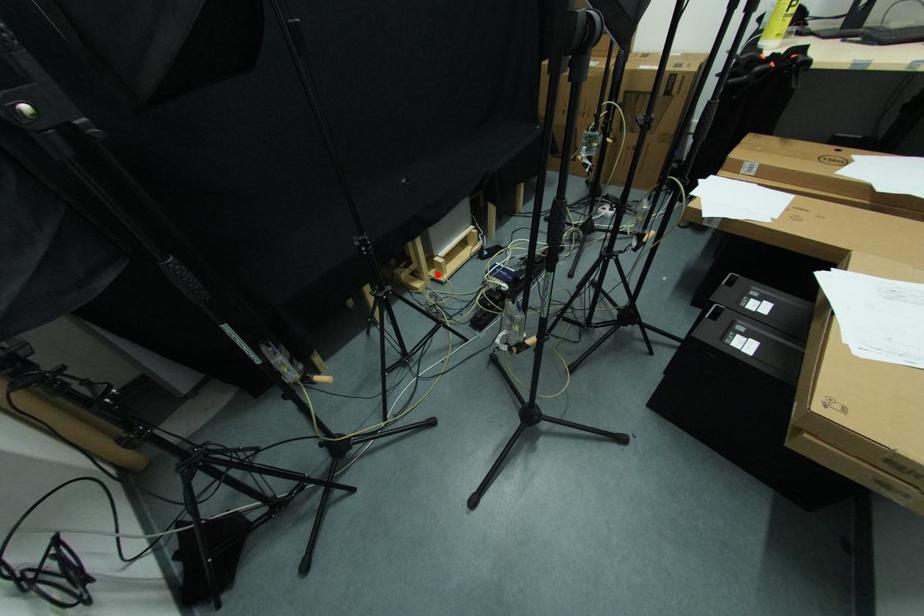
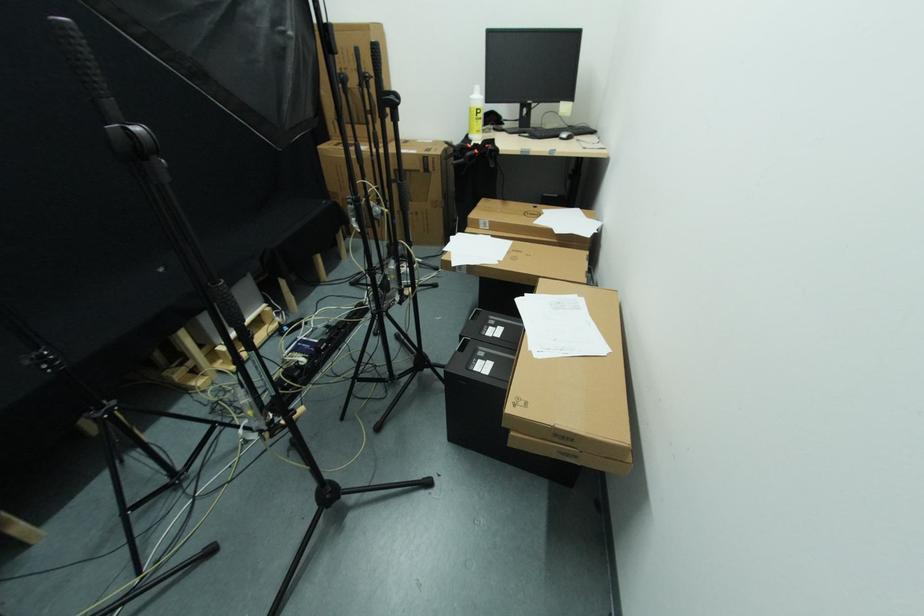
Question: I am providing you with two images of the same scene from different viewpoints. A red point is shown in image1. For the corresponding object point in image2, is it positioned nearer or farther from the camera?

Choices:
 (A) Nearer
 (B) Farther

Answer: (A)